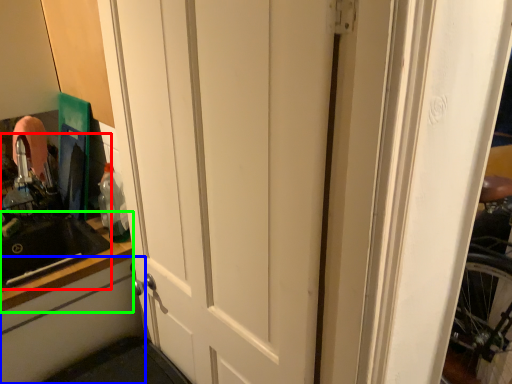
Question: Estimate the real-world distances between objects in this image. Which object is closer to sink (highlighted by a red box), cabinetry (highlighted by a blue box) or counter top (highlighted by a green box)?

Choices:
 (A) cabinetry
 (B) counter top

Answer: (B)